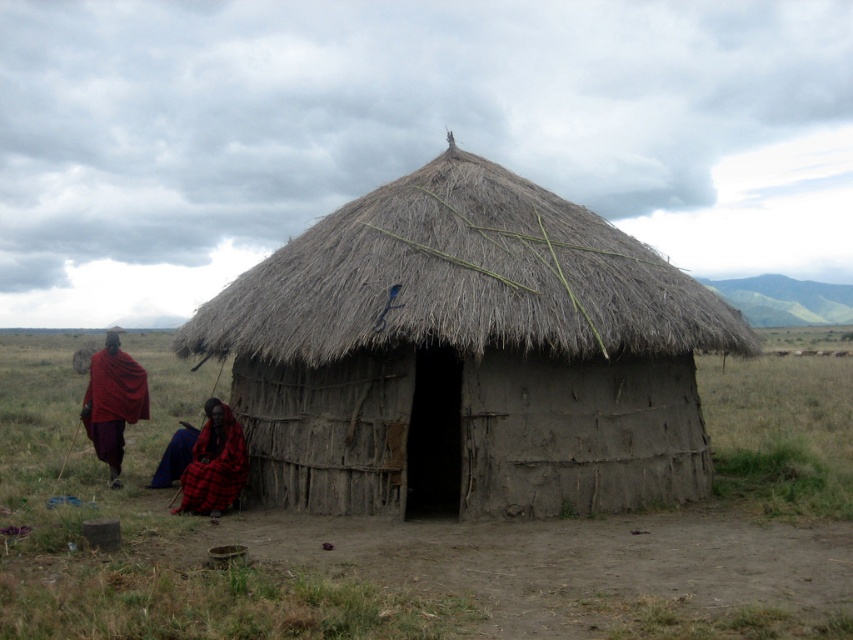
Question: From the image, what is the correct spatial relationship of red plaid shawl at left in relation to red plaid cloth at center?

Choices:
 (A) below
 (B) above

Answer: (B)

Question: Which of these objects is positioned farthest from the red plaid shawl at left?

Choices:
 (A) thatched mud hut at center
 (B) green grassland at center

Answer: (B)

Question: Which point is farther to the camera?

Choices:
 (A) red plaid cloth at center
 (B) red plaid shawl at left

Answer: (B)

Question: Is red plaid shawl at left below red plaid cloth at center?

Choices:
 (A) yes
 (B) no

Answer: (B)

Question: Which point appears farthest from the camera in this image?

Choices:
 (A) (155, 596)
 (B) (180, 502)

Answer: (B)

Question: Is green grassland at center smaller than red plaid shawl at left?

Choices:
 (A) yes
 (B) no

Answer: (A)